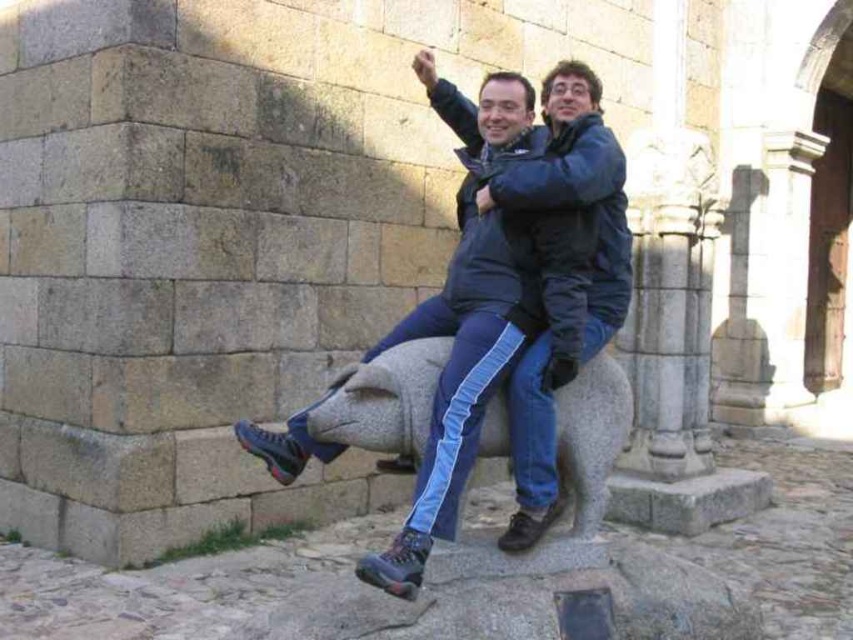
Question: Is matte black jacket at center smaller than gray stone pig at center?

Choices:
 (A) no
 (B) yes

Answer: (A)

Question: Is matte black jacket at center above gray stone pig at center?

Choices:
 (A) no
 (B) yes

Answer: (B)

Question: Which point is closer to the camera?

Choices:
 (A) gray stone pig at center
 (B) matte black jacket at center

Answer: (B)

Question: Is matte black jacket at center closer to camera compared to gray stone pig at center?

Choices:
 (A) no
 (B) yes

Answer: (B)